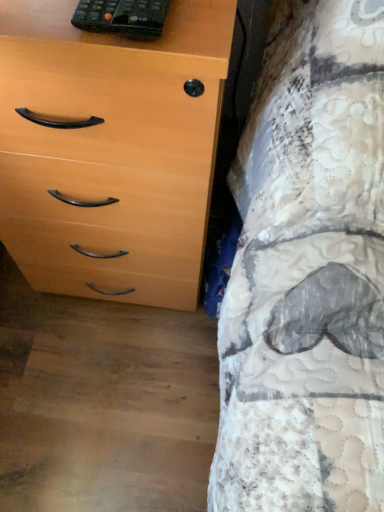
Question: From a real-world perspective, is black plastic remote at upper left physically located above or below light wood/veneer chest of drawers at left?

Choices:
 (A) below
 (B) above

Answer: (B)

Question: Would you say black plastic remote at upper left is to the left or to the right of light wood/veneer chest of drawers at left in the picture?

Choices:
 (A) left
 (B) right

Answer: (B)

Question: Considering the positions of black plastic remote at upper left and light wood/veneer chest of drawers at left in the image, is black plastic remote at upper left wider or thinner than light wood/veneer chest of drawers at left?

Choices:
 (A) wide
 (B) thin

Answer: (B)

Question: From a real-world perspective, relative to black plastic remote at upper left, is light wood/veneer chest of drawers at left vertically above or below?

Choices:
 (A) above
 (B) below

Answer: (B)

Question: Would you say light wood/veneer chest of drawers at left is to the left or to the right of black plastic remote at upper left in the picture?

Choices:
 (A) left
 (B) right

Answer: (A)

Question: Does point (59, 181) appear closer or farther from the camera than point (127, 29)?

Choices:
 (A) farther
 (B) closer

Answer: (A)

Question: From the image's perspective, is light wood/veneer chest of drawers at left above or below black plastic remote at upper left?

Choices:
 (A) below
 (B) above

Answer: (A)